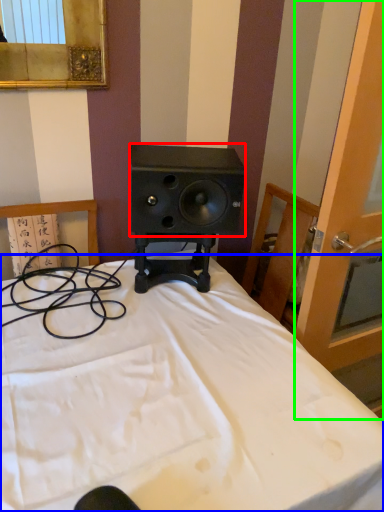
Question: Based on their relative distances, which object is farther from speaker (highlighted by a red box)? Choose from bed (highlighted by a blue box) and screen door (highlighted by a green box).

Choices:
 (A) bed
 (B) screen door

Answer: (A)